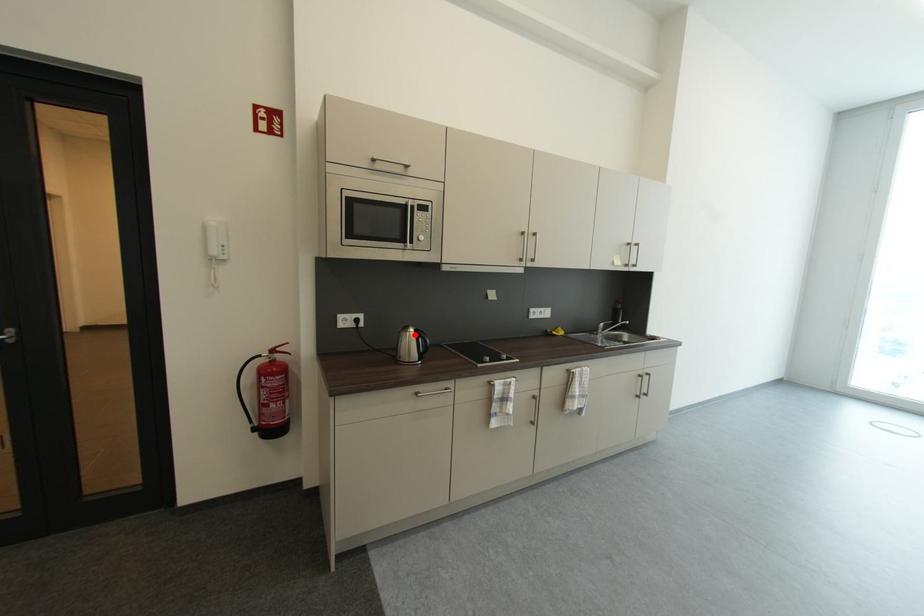
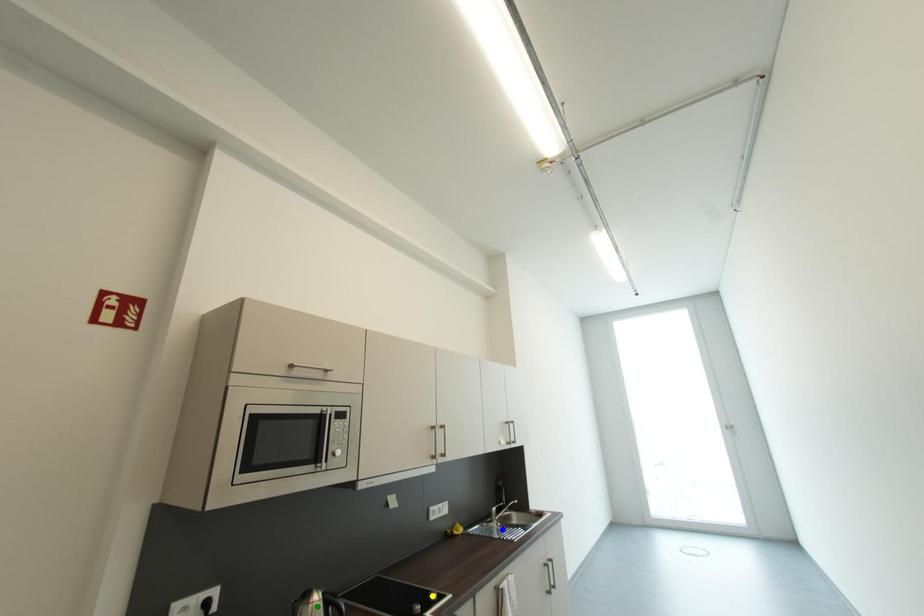
Question: I am providing you with two images of the same scene from different viewpoints. A red point is marked on the first image. You are given multiple points on the second image. Which point in image 2 represents the same 3d spot as the red point in image 1?

Choices:
 (A) blue point
 (B) yellow point
 (C) green point

Answer: (C)